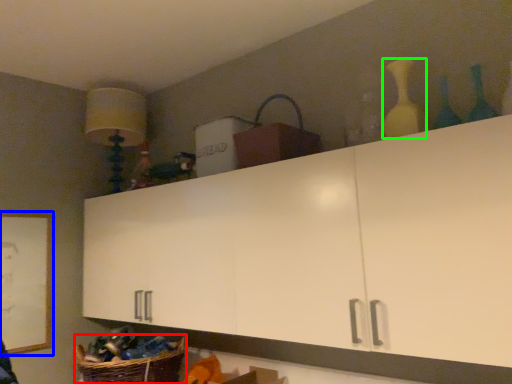
Question: Based on their relative distances, which object is farther from basket (highlighted by a red box)? Choose from picture frame (highlighted by a blue box) and bottle (highlighted by a green box).

Choices:
 (A) picture frame
 (B) bottle

Answer: (B)